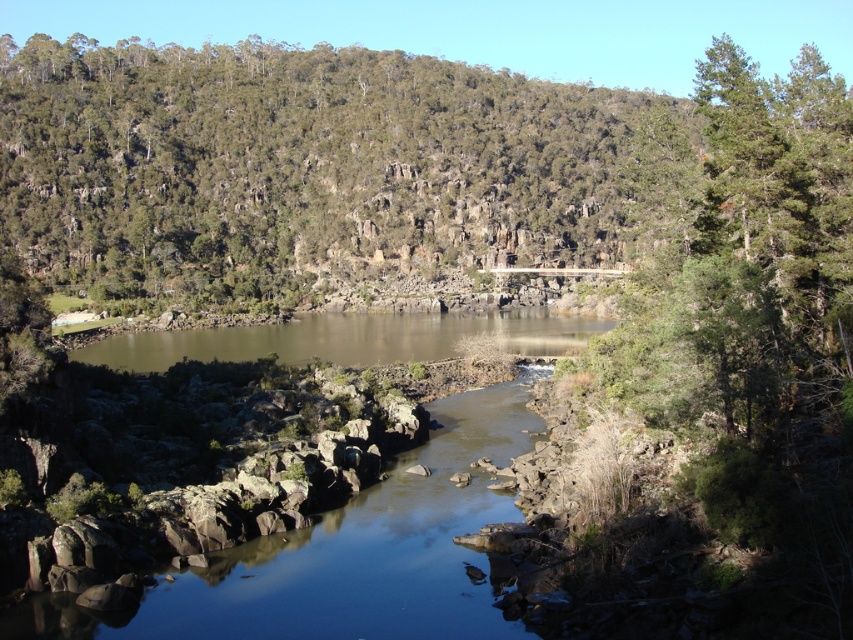
You are planning to set up a picnic area near the green leafy tree at upper center and the brown rock river at center. Which object would provide more shade for your picnic setup?

The green leafy tree at upper center would provide more shade for your picnic setup since it is much taller than the brown rock river at center, creating a larger shaded area.

You are standing at the edge of the green leafy tree at upper center and want to cross to the brown rock river at center. Is the path directly below the tree clear of obstacles?

The green leafy tree at upper center is positioned over brown rock river at center, so the path directly below the tree leads straight to the river without any obstacles in between.

You are standing at the point marked by point (312, 168) in the image. Looking around, you notice a green leafy tree at upper center. Which direction should you walk to reach the green leafy tree at upper center?

The green leafy tree at upper center is located at the coordinates of point (312, 168), which means you are already at the location of the green leafy tree at upper center. Therefore, no movement is needed.